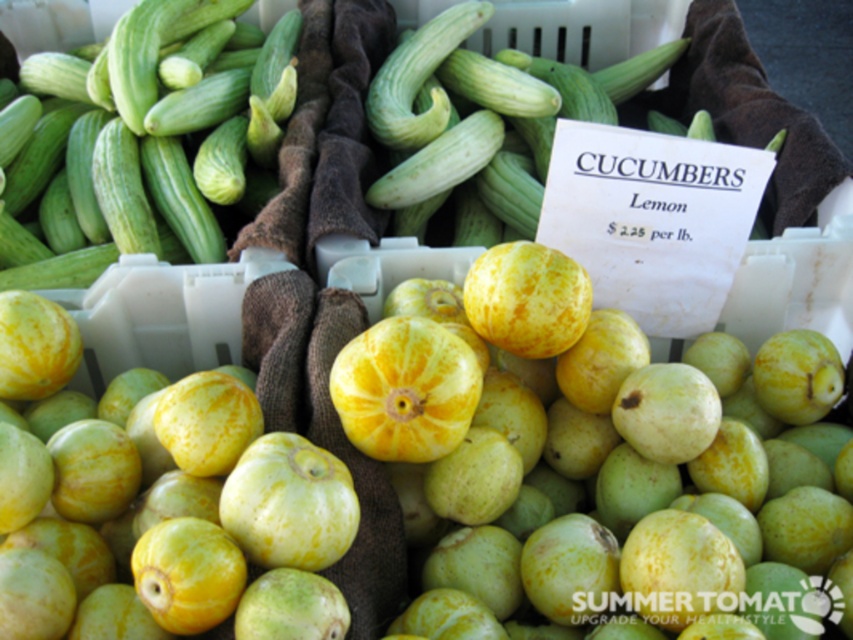
Does green matte melon at center have a lesser height compared to green matte cucumber at upper left?

Correct, green matte melon at center is not as tall as green matte cucumber at upper left.

Between point (74, 449) and point (84, 132), which one is positioned behind?

Positioned behind is point (84, 132).

Locate an element on the screen. This screenshot has height=640, width=853. green matte melon at center is located at coordinates (155, 502).

Who is positioned more to the right, yellow matte melon at center or green matte cucumber at center?

yellow matte melon at center

Who is positioned more to the left, yellow matte melon at center or green matte cucumber at center?

Positioned to the left is green matte cucumber at center.

You are a GUI agent. You are given a task and a screenshot of the screen. Output one action in this format:
    pyautogui.click(x=<x>, y=<y>)
    Task: Click on the yellow matte melon at center
    
    Given the screenshot: What is the action you would take?
    pyautogui.click(x=575, y=401)

This screenshot has width=853, height=640. I want to click on yellow matte melon at center, so click(575, 401).

The image size is (853, 640). Describe the element at coordinates (155, 502) in the screenshot. I see `green matte melon at center` at that location.

Which is behind, point (289, 602) or point (428, 170)?

Positioned behind is point (428, 170).

Does point (146, 380) come behind point (592, 104)?

No, (146, 380) is in front of (592, 104).

The image size is (853, 640). Identify the location of green matte melon at center. (155, 502).